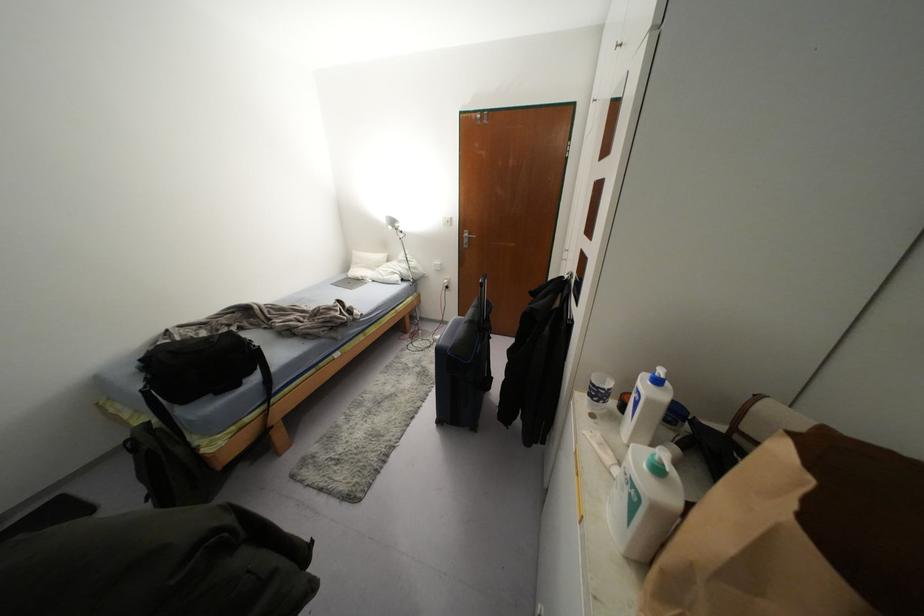
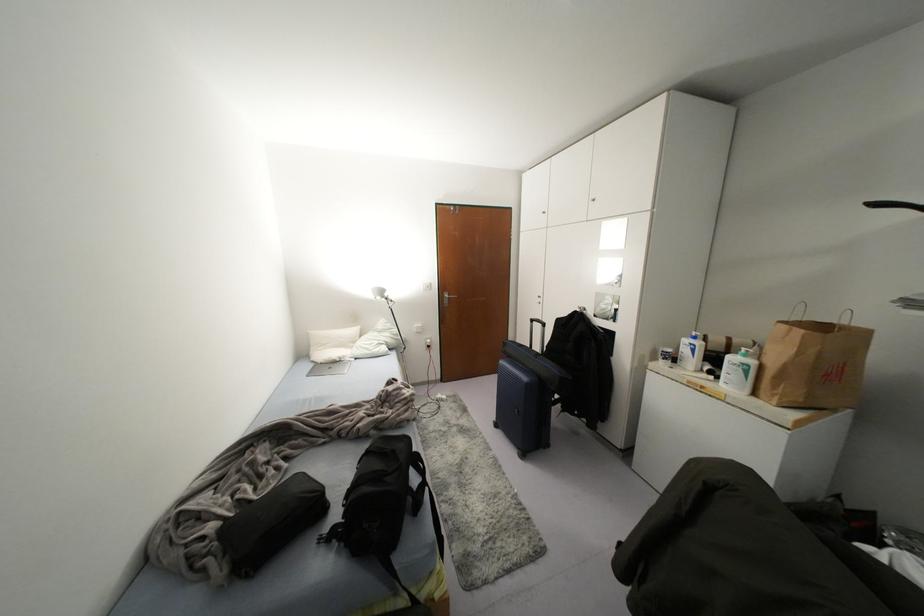
In the second image, find the point that corresponds to (382,256) in the first image.

(354, 330)